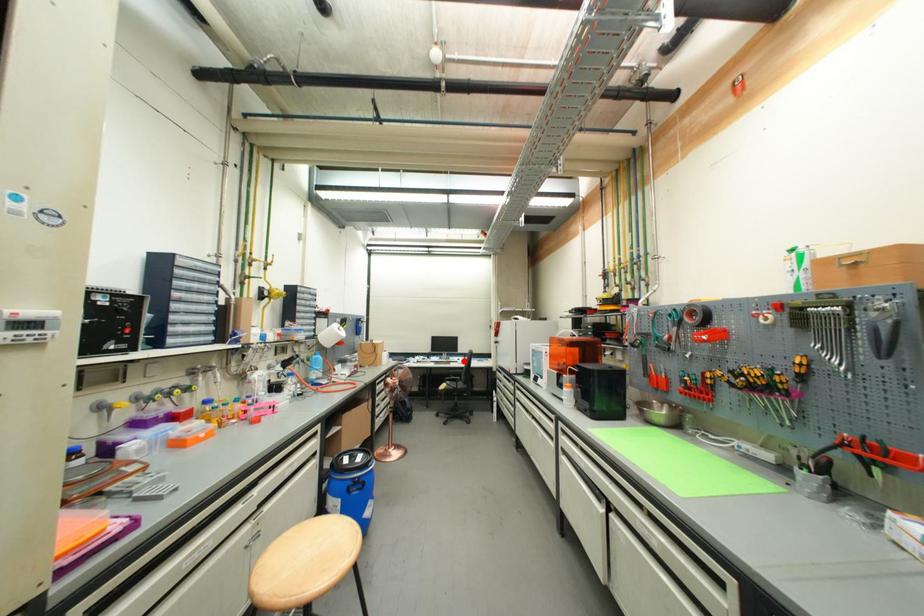
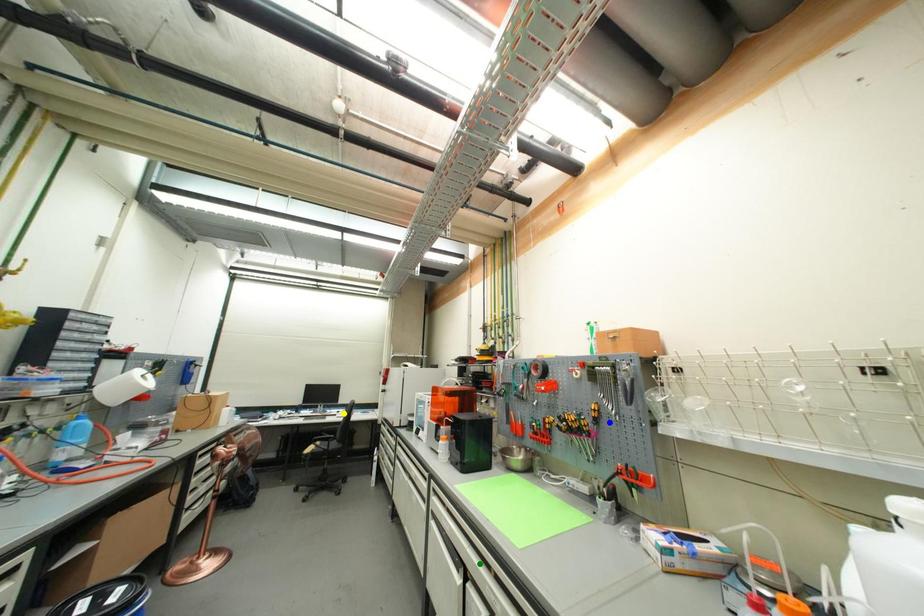
Question: I am providing you with two images of the same scene from different viewpoints. A red point is marked on the first image. You are given multiple points on the second image. Can you choose the point in image 2 that corresponds to the point in image 1?

Choices:
 (A) blue point
 (B) yellow point
 (C) green point

Answer: (B)